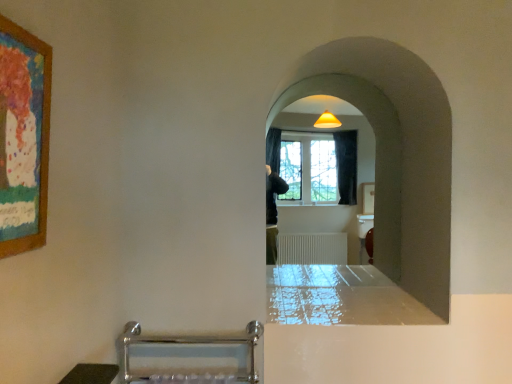
Question: Looking at the image, does wooden painted picture frame at upper left seem bigger or smaller compared to white matte wall at center?

Choices:
 (A) big
 (B) small

Answer: (B)

Question: In terms of width, does wooden painted picture frame at upper left look wider or thinner when compared to white matte wall at center?

Choices:
 (A) thin
 (B) wide

Answer: (A)

Question: Based on their relative distances, which object is nearer to the wooden painted picture frame at upper left?

Choices:
 (A) white matte wall at center
 (B) glossy white counter top at center

Answer: (B)

Question: Which of these objects is positioned farthest from the white matte wall at center?

Choices:
 (A) glossy white counter top at center
 (B) wooden painted picture frame at upper left

Answer: (B)